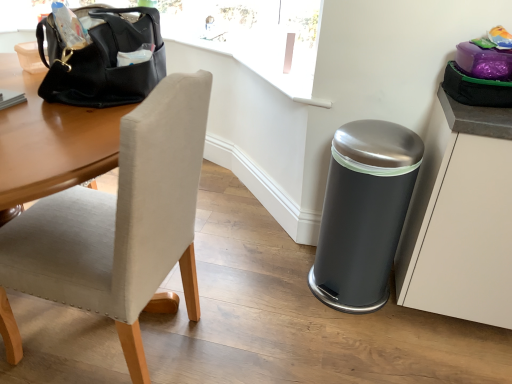
In order to click on vacant region to the right of beige fabric chair at left in this screenshot , I will do `click(257, 321)`.